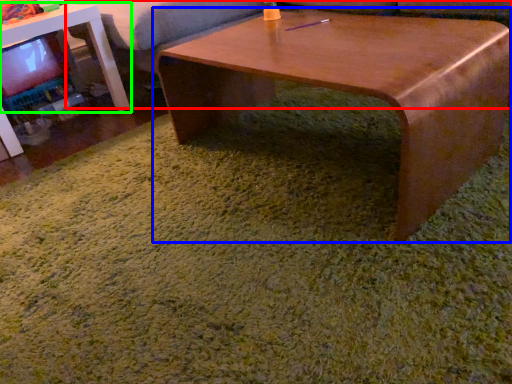
Question: Which is nearer to the couch (highlighted by a red box)? coffee table (highlighted by a blue box) or table (highlighted by a green box).

Choices:
 (A) coffee table
 (B) table

Answer: (B)